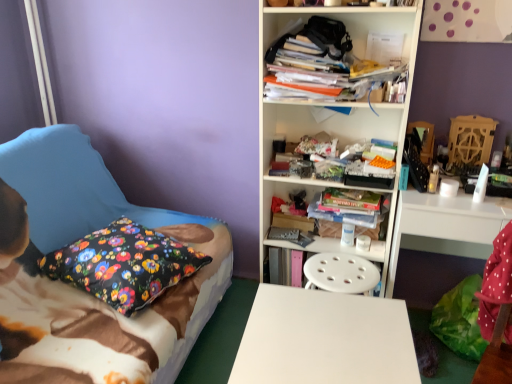
Question: Does stacked books at center turn towards white plastic bookcase at center?

Choices:
 (A) yes
 (B) no

Answer: (A)

Question: Is stacked books at center not within white plastic bookcase at center?

Choices:
 (A) yes
 (B) no

Answer: (B)

Question: Is stacked books at center at the left side of white plastic bookcase at center?

Choices:
 (A) yes
 (B) no

Answer: (B)

Question: From the image's perspective, is stacked books at center located above white plastic bookcase at center?

Choices:
 (A) no
 (B) yes

Answer: (A)

Question: Does stacked books at center touch white plastic bookcase at center?

Choices:
 (A) yes
 (B) no

Answer: (B)

Question: Can you confirm if stacked books at center is bigger than white plastic bookcase at center?

Choices:
 (A) no
 (B) yes

Answer: (A)

Question: Is white glossy computer desk at right not close to floral fabric pillow at left?

Choices:
 (A) no
 (B) yes

Answer: (B)

Question: Does white glossy computer desk at right appear on the left side of floral fabric pillow at left?

Choices:
 (A) no
 (B) yes

Answer: (A)

Question: Does white glossy computer desk at right have a lesser height compared to floral fabric pillow at left?

Choices:
 (A) no
 (B) yes

Answer: (A)

Question: From a real-world perspective, is white glossy computer desk at right physically below floral fabric pillow at left?

Choices:
 (A) no
 (B) yes

Answer: (B)

Question: Is white glossy computer desk at right oriented towards floral fabric pillow at left?

Choices:
 (A) no
 (B) yes

Answer: (A)

Question: Does white glossy computer desk at right have a greater height compared to floral fabric pillow at left?

Choices:
 (A) yes
 (B) no

Answer: (A)

Question: From a real-world perspective, is white smooth desk at center located higher than white plastic bookcase at center?

Choices:
 (A) yes
 (B) no

Answer: (B)